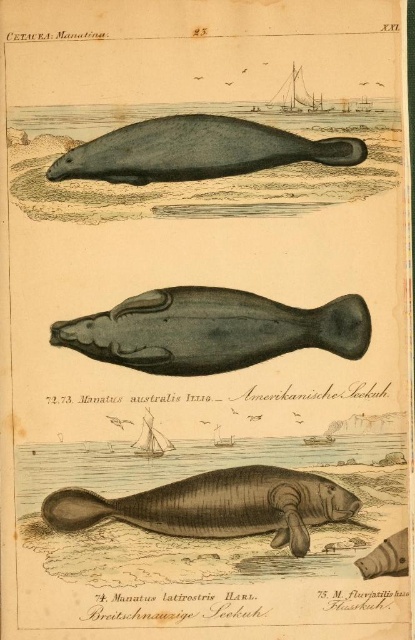
What do you see at coordinates (212, 330) in the screenshot? The width and height of the screenshot is (415, 640). I see `dark gray matte whale at center` at bounding box center [212, 330].

Is point (55, 337) farther from viewer compared to point (275, 540)?

That is True.

Is point (136, 344) less distant than point (190, 483)?

That is False.

I want to click on dark gray matte whale at center, so click(x=212, y=330).

Is dark gray matte whale at center smaller than smooth gray seal at lower right?

No, dark gray matte whale at center is not smaller than smooth gray seal at lower right.

Consider the image. Does dark gray matte whale at center come in front of smooth gray seal at lower right?

No, dark gray matte whale at center is behind smooth gray seal at lower right.

Measure the distance between dark gray matte whale at center and camera.

The distance of dark gray matte whale at center from camera is 35.54 inches.

Locate an element on the screen. Image resolution: width=415 pixels, height=640 pixels. dark gray matte whale at center is located at coordinates (212, 330).

Can you confirm if brown textured seal at center is smaller than gray matte seal at upper center?

Incorrect, brown textured seal at center is not smaller in size than gray matte seal at upper center.

Measure the distance between point (273, 477) and camera.

The distance of point (273, 477) from camera is 35.92 inches.

Between point (302, 552) and point (348, 161), which one is positioned in front?

Point (302, 552)

At what (x,y) coordinates should I click in order to perform the action: click on brown textured seal at center. Please return your answer as a coordinate pair (x, y). The height and width of the screenshot is (640, 415). Looking at the image, I should click on (217, 506).